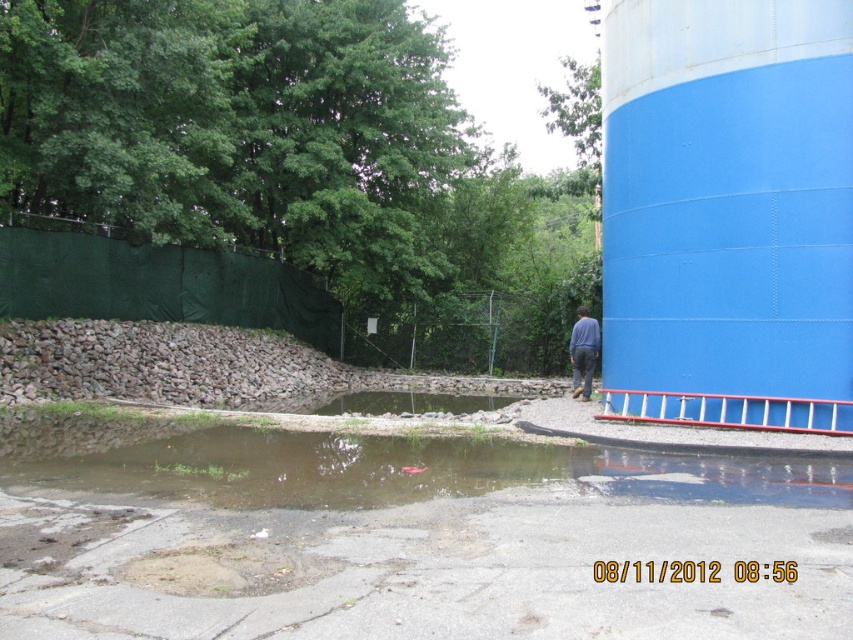
Question: Does blue painted steel water tower at right have a smaller size compared to brown concrete flood at lower center?

Choices:
 (A) no
 (B) yes

Answer: (B)

Question: Which point is closer to the camera?

Choices:
 (A) blue painted steel water tower at right
 (B) brown concrete flood at lower center

Answer: (B)

Question: Does blue painted steel water tower at right have a larger size compared to brown concrete flood at lower center?

Choices:
 (A) yes
 (B) no

Answer: (B)

Question: Is brown concrete flood at lower center to the left of blue jeans at lower right from the viewer's perspective?

Choices:
 (A) yes
 (B) no

Answer: (A)

Question: Which object appears farthest from the camera in this image?

Choices:
 (A) blue painted steel water tower at right
 (B) brown concrete flood at lower center
 (C) blue jeans at lower right

Answer: (C)

Question: Based on their relative distances, which object is farther from the blue painted steel water tower at right?

Choices:
 (A) brown concrete flood at lower center
 (B) blue jeans at lower right

Answer: (B)